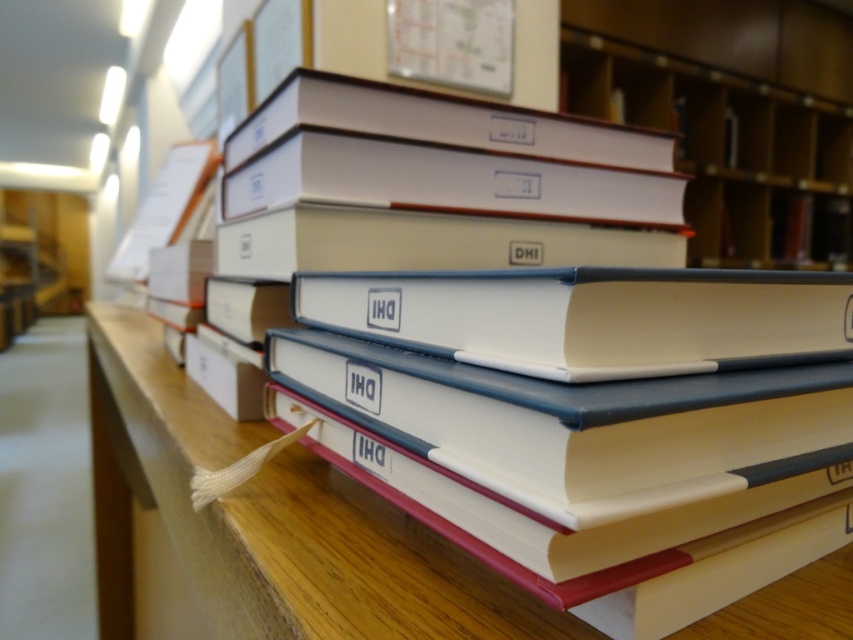
Based on the photo, you are standing in front of a stack of books arranged on a wooden table in a library. You notice two points marked on the table surface. The first point is at coordinates point (601, 353) and the second point is at point (579, 72). Which of these two points is closer to you?

Point (601, 353) is closer to the camera than point (579, 72), so the first point is closer to you.

From the picture: You are a librarian who needs to place a new book on the shelf. The new book is exactly 10 feet long. You see the white matte book at center and the matte white book at upper center. Can the new book fit between them?

The distance between the white matte book at center and the matte white book at upper center is 9.44 feet. Since the new book is 10 feet long, it cannot fit between them as the space is slightly shorter than the book.